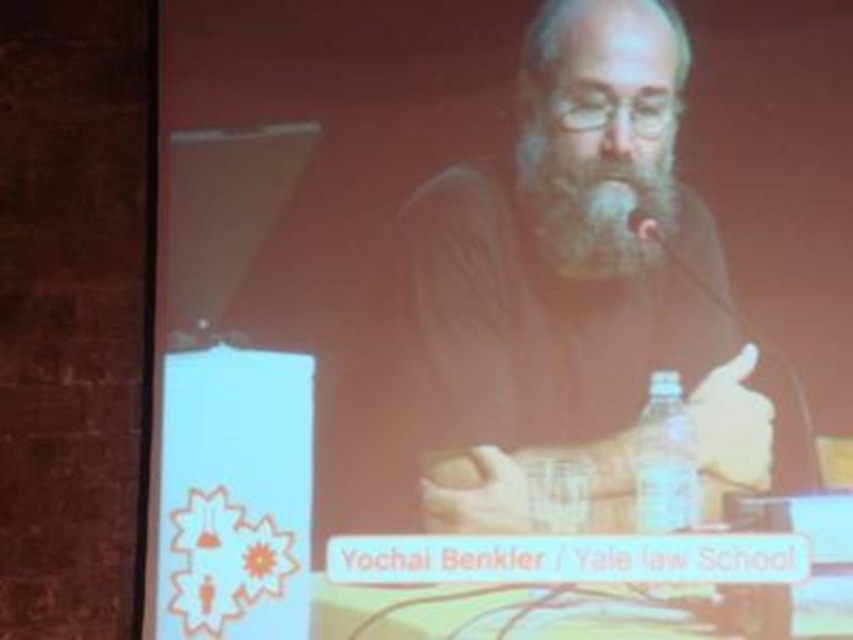
Which of these two, white soft beard at center or clear plastic bottle at lower right, stands shorter?

white soft beard at center is shorter.

Between white soft beard at center and clear plastic bottle at lower right, which one is positioned lower?

clear plastic bottle at lower right is below.

What are the coordinates of `white soft beard at center` in the screenshot? It's located at (595, 208).

Between point (416, 376) and point (677, 403), which one is positioned in front?

Point (677, 403)

Who is higher up, smooth skin man at center or clear plastic bottle at lower right?

Positioned higher is smooth skin man at center.

Is point (711, 262) farther from viewer compared to point (636, 460)?

That is True.

Where is `smooth skin man at center`? smooth skin man at center is located at coordinates (579, 298).

Is the position of smooth skin man at center more distant than that of white soft beard at center?

No, it is in front of white soft beard at center.

Is smooth skin man at center above white soft beard at center?

Incorrect, smooth skin man at center is not positioned above white soft beard at center.

Who is more forward, (x=500, y=211) or (x=602, y=256)?

Point (x=602, y=256)

Where is `smooth skin man at center`? The width and height of the screenshot is (853, 640). smooth skin man at center is located at coordinates (579, 298).